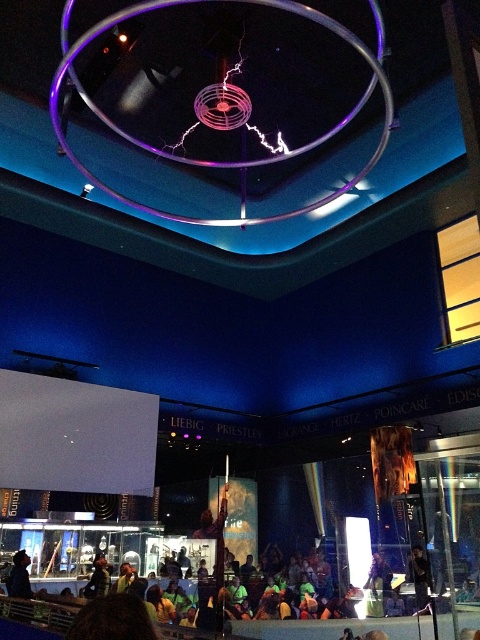
Question: Among these objects, which one is nearest to the camera?

Choices:
 (A) matte black jacket at lower left
 (B) black fabric at lower center

Answer: (A)

Question: In this image, where is matte black jacket at lower left located relative to black fabric at lower center?

Choices:
 (A) left
 (B) right

Answer: (A)

Question: Is matte black jacket at lower left to the right of black fabric at lower center from the viewer's perspective?

Choices:
 (A) no
 (B) yes

Answer: (A)

Question: Does matte black jacket at lower left have a smaller size compared to black fabric at lower center?

Choices:
 (A) yes
 (B) no

Answer: (B)